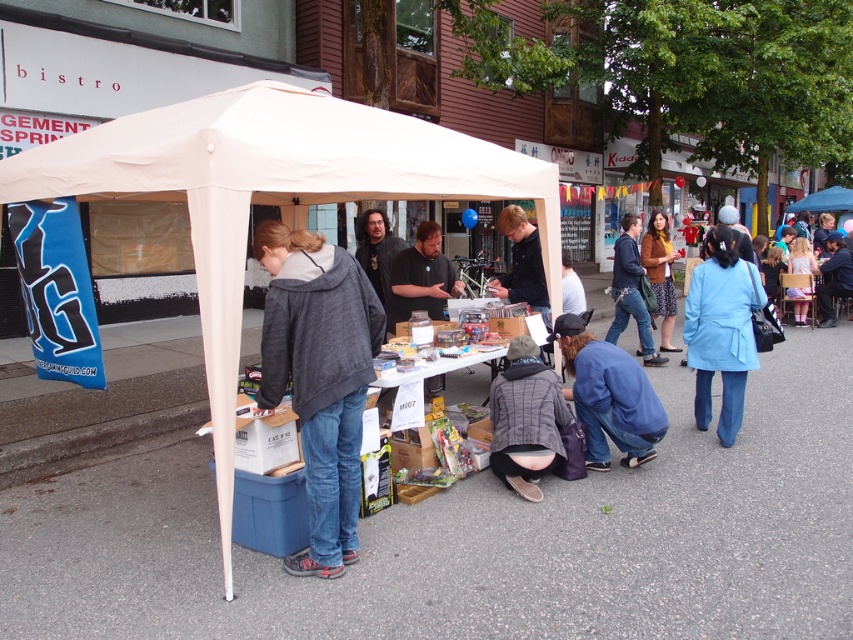
Does gray textured jacket at lower center appear over blue denim jeans at center?

Incorrect, gray textured jacket at lower center is not positioned above blue denim jeans at center.

Between gray textured jacket at lower center and blue denim jeans at center, which one appears on the left side from the viewer's perspective?

Positioned to the left is gray textured jacket at lower center.

Image resolution: width=853 pixels, height=640 pixels. In order to click on gray textured jacket at lower center in this screenshot , I will do `click(526, 419)`.

Does gray textured jacket at lower center appear over brown woolen sweater at upper right?

Incorrect, gray textured jacket at lower center is not positioned above brown woolen sweater at upper right.

Between point (531, 356) and point (660, 340), which one is positioned in front?

Point (531, 356)

Find the location of a particular element. gray textured jacket at lower center is located at coordinates (526, 419).

This screenshot has height=640, width=853. What do you see at coordinates (271, 193) in the screenshot? I see `white fabric tent at center` at bounding box center [271, 193].

Can you confirm if white fabric tent at center is positioned below blue cotton shirt at lower center?

No.

This screenshot has width=853, height=640. I want to click on white fabric tent at center, so click(271, 193).

The height and width of the screenshot is (640, 853). What are the coordinates of `white fabric tent at center` in the screenshot? It's located at (271, 193).